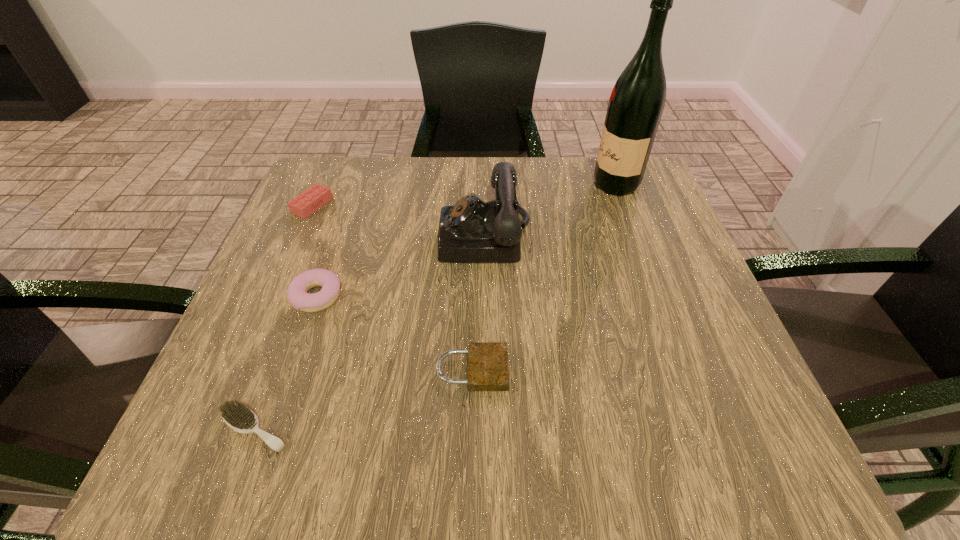
This screenshot has width=960, height=540. Find the location of `the tallest object`. the tallest object is located at coordinates (636, 104).

This screenshot has height=540, width=960. I want to click on the rightmost object, so click(x=636, y=104).

Image resolution: width=960 pixels, height=540 pixels. Find the location of `the second tallest object`. the second tallest object is located at coordinates (472, 231).

Locate an element on the screen. doughnut is located at coordinates (297, 290).

Find the location of a particular element. the fourth tallest object is located at coordinates (306, 203).

Identify the location of padlock. Image resolution: width=960 pixels, height=540 pixels. (487, 362).

The width and height of the screenshot is (960, 540). I want to click on the nearest object, so click(238, 417).

This screenshot has width=960, height=540. In order to click on vacant space positioned 0.360m on the front-facing side of the tallest object in this screenshot , I will do `click(443, 185)`.

Locate an element on the screen. This screenshot has height=540, width=960. vacant space located on the front-facing side of the tallest object is located at coordinates (485, 185).

The width and height of the screenshot is (960, 540). I want to click on vacant space located on the front-facing side of the tallest object, so click(540, 185).